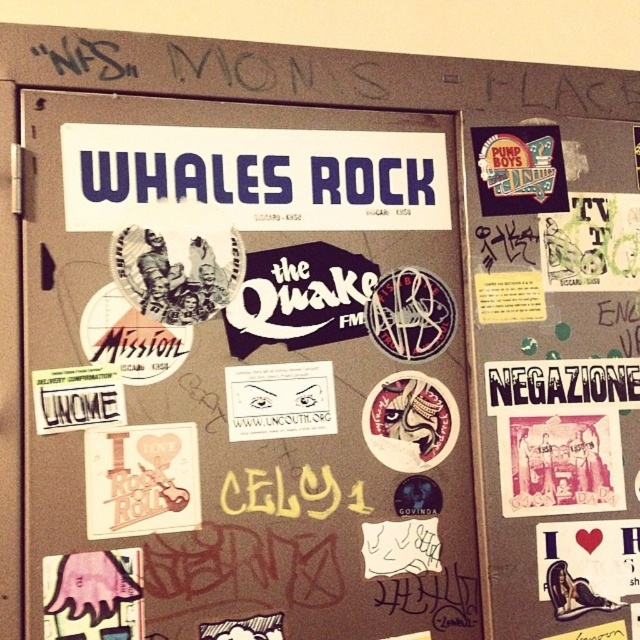
You are standing in front of the door and want to place a new sticker between the white paper at center and the white paper at upper center. Which paper should you place it closer to in order to make it appear in the middle between them?

To place the new sticker exactly in the middle between the white paper at center and the white paper at upper center, you should position it closer to the white paper at upper center since the white paper at center is closer to the viewer. This way, the sticker will visually appear midway between the two papers.

You are a student who needs to hang a new poster on the door. The poster is 12 inches tall. You want to place it between the white paper at center and the white paper at upper center. Is there enough space to fit the poster vertically?

The distance between the white paper at center and the white paper at upper center is 11.30 inches. Since the poster is 12 inches tall, there isn t enough space to fit it vertically between them.

You are standing in front of the door and want to hang a new sticker. You have a small sticker that you want to place so it covers both the white paper at center and the matte black sticker at upper right. Is this possible?

The white paper at center is closer to the viewer than the matte black sticker at upper right, so the small sticker cannot cover both because they are at different depths.